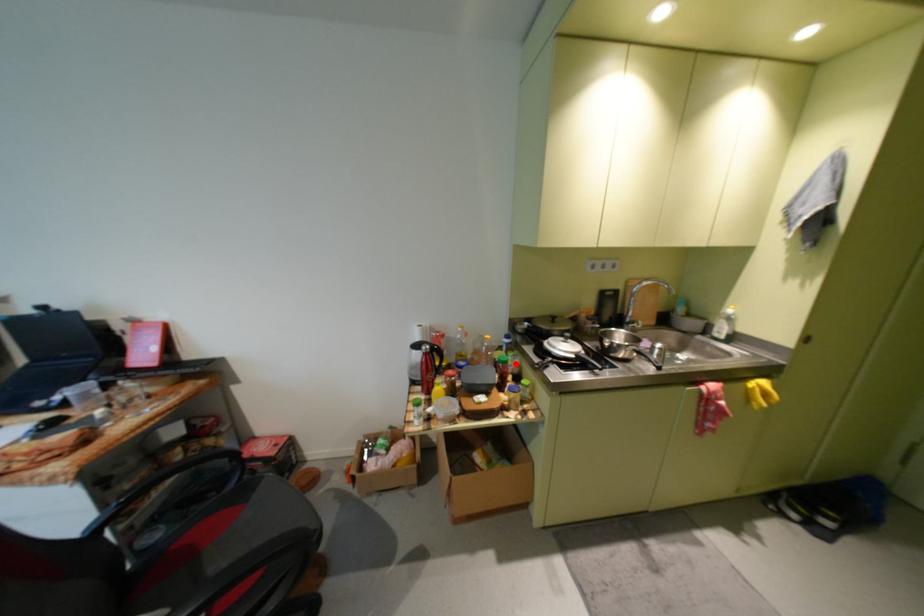
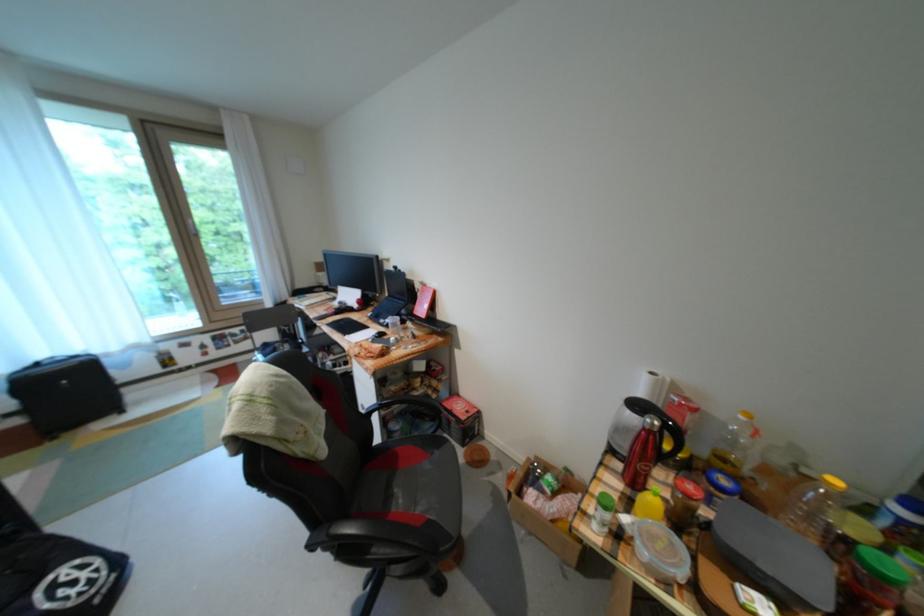
Question: I am providing you with two images of the same scene from different viewpoints. A red point is shown in image1. For the corresponding object point in image2, is it positioned nearer or farther from the camera?

Choices:
 (A) Nearer
 (B) Farther

Answer: (B)